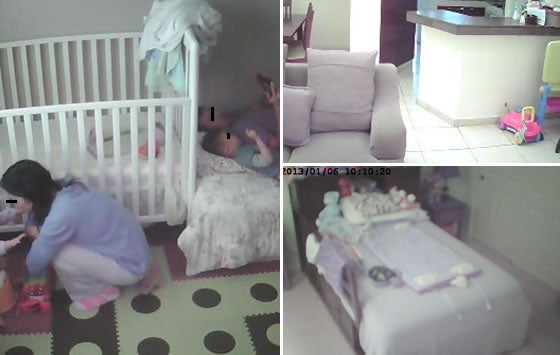
This screenshot has width=560, height=355. I want to click on toy, so click(514, 130).